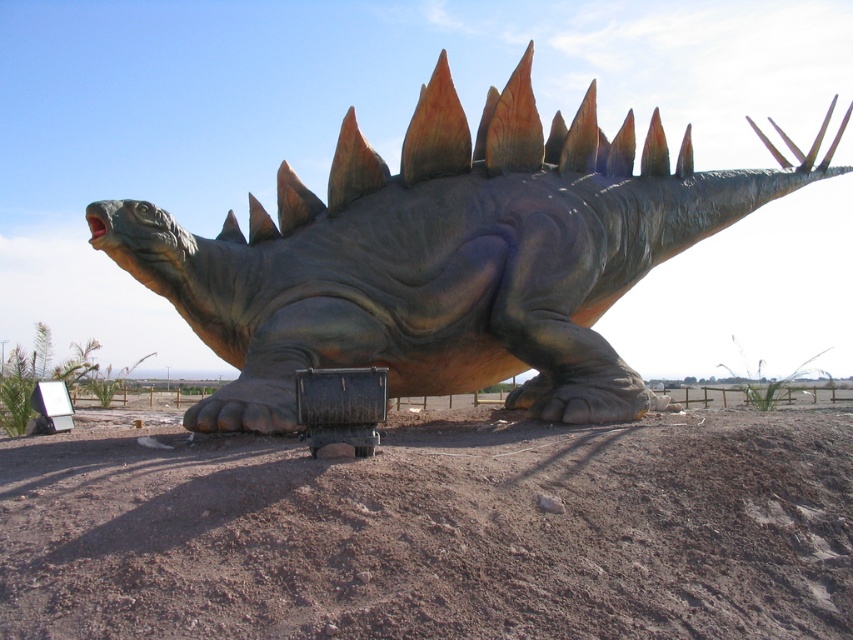
You are standing at the point labeled point (x=436, y=531) in the desert scene with the dinosaur sculpture. What is the terrain like directly beneath your feet?

The terrain directly beneath point (x=436, y=531) is brown sandy dirt at center.

You are standing in front of the shiny metallic dinosaur at center and want to walk to the brown sandy dirt at center. In which direction should you move relative to the dinosaur?

To reach the brown sandy dirt at center from the shiny metallic dinosaur at center, you should move to the right since the brown sandy dirt at center is located to the right of the shiny metallic dinosaur at center.